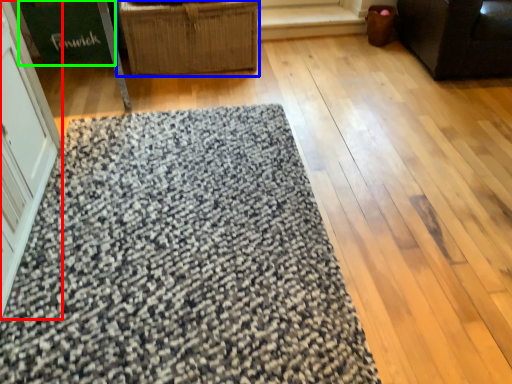
Question: Which object is positioned closest to screen door (highlighted by a red box)? Select from furniture (highlighted by a blue box) and cardboard box (highlighted by a green box).

Choices:
 (A) furniture
 (B) cardboard box

Answer: (A)